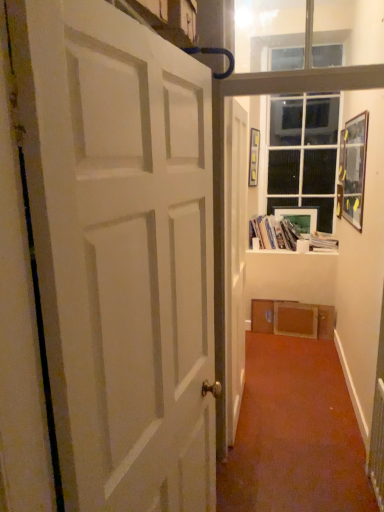
You are a GUI agent. You are given a task and a screenshot of the screen. Output one action in this format:
    pyautogui.click(x=<x>, y=<y>)
    Task: Click on the matte plastic picture frame at upper center, which is the first picture frame from back to front
    
    Given the screenshot: What is the action you would take?
    pyautogui.click(x=299, y=218)

In order to face white glossy bookshelf at upper center, which is counted as the second book, starting from the right, should I rotate leftwards or rightwards?

You should look right and rotate roughly 11.732 degrees.

This screenshot has width=384, height=512. What are the coordinates of `white plastic radiator at lower right` in the screenshot? It's located at (377, 445).

Measure the distance between white plastic radiator at lower right and camera.

white plastic radiator at lower right and camera are 2.00 meters apart from each other.

This screenshot has width=384, height=512. I want to click on white paper stack at upper right, which is the 1th book in right-to-left order, so click(323, 243).

This screenshot has width=384, height=512. I want to click on wooden picture frame at upper right, marked as the second picture frame in a back-to-front arrangement, so click(352, 170).

Which door is the 1st one when counting from the front of the white glossy bookshelf at upper center, which is counted as the second book, starting from the right? Please provide its 2D coordinates.

[(235, 256)]

Is white matte door at center, the 1th door from the right, smaller than white glossy bookshelf at upper center, which is counted as the second book, starting from the right?

Actually, white matte door at center, the 1th door from the right, might be larger than white glossy bookshelf at upper center, which is counted as the second book, starting from the right.

Does point (225, 252) come behind point (329, 241)?

No.

Could you tell me if white matte door at center, acting as the second door starting from the front, is facing white glossy bookshelf at upper center, which is counted as the second book, starting from the right?

No.

Considering the relative positions of white glass window at upper center and white plastic radiator at lower right in the image provided, is white glass window at upper center behind white plastic radiator at lower right?

Yes.

Consider the image. What's the angular difference between white glass window at upper center and white plastic radiator at lower right's facing directions?

89 degrees separate the facing orientations of white glass window at upper center and white plastic radiator at lower right.

The width and height of the screenshot is (384, 512). Find the location of `radiator in front of the white glass window at upper center`. radiator in front of the white glass window at upper center is located at coordinates (377, 445).

Can you confirm if white paper stack at upper right, which is the 1th book in right-to-left order, is taller than white plastic radiator at lower right?

Incorrect, the height of white paper stack at upper right, which is the 1th book in right-to-left order, is not larger of that of white plastic radiator at lower right.

Based on the photo, would you say white paper stack at upper right, the 2th book viewed from the left, contains white plastic radiator at lower right?

No, white plastic radiator at lower right is not inside white paper stack at upper right, the 2th book viewed from the left.

Is white paper stack at upper right, the 2th book viewed from the left, in front of or behind white plastic radiator at lower right in the image?

white paper stack at upper right, the 2th book viewed from the left, is behind white plastic radiator at lower right.

In the scene shown: Would you say white glass window at upper center is outside white matte door at center, arranged as the 1th door when viewed from the back?

Absolutely, white glass window at upper center is external to white matte door at center, arranged as the 1th door when viewed from the back.

From the image's perspective, is white glass window at upper center above or below white matte door at center, arranged as the 1th door when viewed from the back?

From the image's perspective, white glass window at upper center appears above white matte door at center, arranged as the 1th door when viewed from the back.

Considering the positions of objects white glass window at upper center and white matte door at center, the 1th door from the right, in the image provided, who is in front, white glass window at upper center or white matte door at center, the 1th door from the right,?

white matte door at center, the 1th door from the right, is closer to the camera.

Which object is closer to the camera taking this photo, white matte door at left, which ranks as the second door in right-to-left order, or wooden picture frame at upper right, marked as the second picture frame in a back-to-front arrangement?

Positioned in front is white matte door at left, which ranks as the second door in right-to-left order.

Is point (123, 274) farther from viewer compared to point (362, 196)?

No, (123, 274) is closer to viewer.

Starting from the wooden picture frame at upper right, placed as the 1th picture frame when sorted from front to back, which door is the 2nd one in front? Please provide its 2D coordinates.

[(126, 258)]

Considering the relative positions of white matte door at left, which is counted as the second door, starting from the back, and wooden picture frame at upper right, marked as the second picture frame in a back-to-front arrangement, in the image provided, is white matte door at left, which is counted as the second door, starting from the back, to the right of wooden picture frame at upper right, marked as the second picture frame in a back-to-front arrangement, from the viewer's perspective?

Incorrect, white matte door at left, which is counted as the second door, starting from the back, is not on the right side of wooden picture frame at upper right, marked as the second picture frame in a back-to-front arrangement.

From a real-world perspective, is white glossy bookshelf at upper center, which is the 1th book from left to right, above or below white matte door at center, acting as the second door starting from the front?

Clearly, from a real-world perspective, white glossy bookshelf at upper center, which is the 1th book from left to right, is below white matte door at center, acting as the second door starting from the front.

Is white glossy bookshelf at upper center, which is counted as the second book, starting from the right, smaller than white matte door at center, positioned as the 2th door in left-to-right order?

Indeed, white glossy bookshelf at upper center, which is counted as the second book, starting from the right, has a smaller size compared to white matte door at center, positioned as the 2th door in left-to-right order.

Is white glossy bookshelf at upper center, which is counted as the second book, starting from the right, at the left side of white matte door at center, the 1th door from the right?

No.

Where is `picture frame on the right of the matte plastic picture frame at upper center, which is the first picture frame from back to front`? The height and width of the screenshot is (512, 384). picture frame on the right of the matte plastic picture frame at upper center, which is the first picture frame from back to front is located at coordinates (352, 170).

In the scene shown: Is matte plastic picture frame at upper center, the 2th picture frame positioned from the front, not near wooden picture frame at upper right, placed as the 1th picture frame when sorted from front to back?

Yes, matte plastic picture frame at upper center, the 2th picture frame positioned from the front, and wooden picture frame at upper right, placed as the 1th picture frame when sorted from front to back, are quite far apart.

Is matte plastic picture frame at upper center, which is the first picture frame from back to front, looking in the opposite direction of wooden picture frame at upper right, marked as the second picture frame in a back-to-front arrangement?

That's not correct — matte plastic picture frame at upper center, which is the first picture frame from back to front, is not looking away from wooden picture frame at upper right, marked as the second picture frame in a back-to-front arrangement.

Which of these two, matte plastic picture frame at upper center, the 2th picture frame positioned from the front, or wooden picture frame at upper right, marked as the second picture frame in a back-to-front arrangement, is thinner?

matte plastic picture frame at upper center, the 2th picture frame positioned from the front, is thinner.

From the image's perspective, count 1st doors downward from the white glossy bookshelf at upper center, which is counted as the second book, starting from the right, and point to it. Please provide its 2D coordinates.

[(235, 256)]

In the image, there is a white plastic radiator at lower right. At what (x,y) coordinates should I click in order to perform the action: click on window above it (from the image's perspective). Please return your answer as a coordinate pair (x, y). Image resolution: width=384 pixels, height=512 pixels. Looking at the image, I should click on (303, 154).

From the image, which object appears to be farther from white matte door at left, which is counted as the second door, starting from the back, white glossy bookshelf at upper center, which is the 1th book from left to right, or white matte door at center, arranged as the 1th door when viewed from the back?

white glossy bookshelf at upper center, which is the 1th book from left to right, is positioned further to the anchor white matte door at left, which is counted as the second door, starting from the back.

Looking at this image, based on their spatial positions, is matte plastic picture frame at upper center, which is the first picture frame from back to front, or white matte door at center, positioned as the 2th door in left-to-right order, closer to white glossy bookshelf at upper center, which is the 1th book from left to right?

matte plastic picture frame at upper center, which is the first picture frame from back to front, is closer to white glossy bookshelf at upper center, which is the 1th book from left to right.

Considering their positions, is matte plastic picture frame at upper center, which is the first picture frame from back to front, positioned closer to white paper stack at upper right, which is the 1th book in right-to-left order, than white matte door at left, which is the first door from left to right?

Among the two, matte plastic picture frame at upper center, which is the first picture frame from back to front, is located nearer to white paper stack at upper right, which is the 1th book in right-to-left order.

From the picture: Based on their spatial positions, is matte plastic picture frame at upper center, the 2th picture frame positioned from the front, or white matte door at center, positioned as the 2th door in left-to-right order, further from wooden picture frame at upper right, placed as the 1th picture frame when sorted from front to back?

white matte door at center, positioned as the 2th door in left-to-right order.

Estimate the real-world distances between objects in this image. Which object is closer to wooden picture frame at upper right, placed as the 1th picture frame when sorted from front to back, white paper stack at upper right, the 2th book viewed from the left, or white matte door at center, acting as the second door starting from the front?

white paper stack at upper right, the 2th book viewed from the left.

When comparing their distances from white matte door at left, which is the first door from left to right, does white plastic radiator at lower right or matte plastic picture frame at upper center, which is the first picture frame from back to front, seem further?

matte plastic picture frame at upper center, which is the first picture frame from back to front.

From the image, which object appears to be farther from matte plastic picture frame at upper center, which is the first picture frame from back to front, white matte door at center, positioned as the 2th door in left-to-right order, or white matte door at left, the 1th door when ordered from front to back?

white matte door at left, the 1th door when ordered from front to back.

Considering their positions, is matte plastic picture frame at upper center, which is the first picture frame from back to front, positioned closer to wooden picture frame at upper right, marked as the second picture frame in a back-to-front arrangement, than white plastic radiator at lower right?

Based on the image, matte plastic picture frame at upper center, which is the first picture frame from back to front, appears to be nearer to wooden picture frame at upper right, marked as the second picture frame in a back-to-front arrangement.

Image resolution: width=384 pixels, height=512 pixels. In order to click on door located between white plastic radiator at lower right and white glass window at upper center in the depth direction in this screenshot , I will do `click(235, 256)`.

Locate an element on the screen. Image resolution: width=384 pixels, height=512 pixels. picture frame between white matte door at center, acting as the second door starting from the front, and white paper stack at upper right, which is the 1th book in right-to-left order, in the front-back direction is located at coordinates (352, 170).

Identify the location of window between white matte door at center, positioned as the 2th door in left-to-right order, and white paper stack at upper right, the 2th book viewed from the left, from front to back. This screenshot has width=384, height=512. [303, 154].

I want to click on radiator between white matte door at left, which is counted as the second door, starting from the back, and matte plastic picture frame at upper center, the 2th picture frame positioned from the front, from front to back, so click(x=377, y=445).